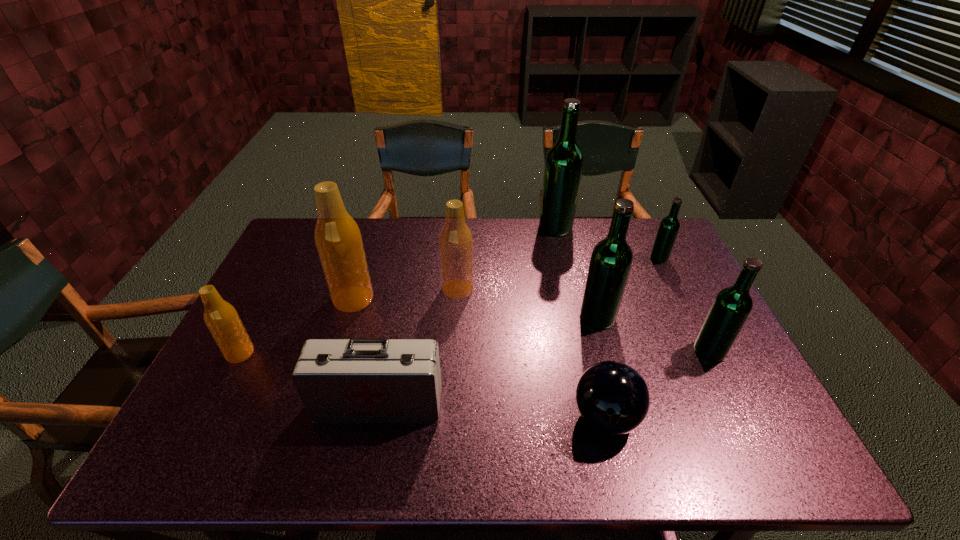
This screenshot has height=540, width=960. What are the coordinates of `vacant space that satisfies the following two spatial constraints: 1. on the back side of the biggest tan beer bottle; 2. on the right side of the leftmost tan beer bottle` in the screenshot? It's located at (269, 299).